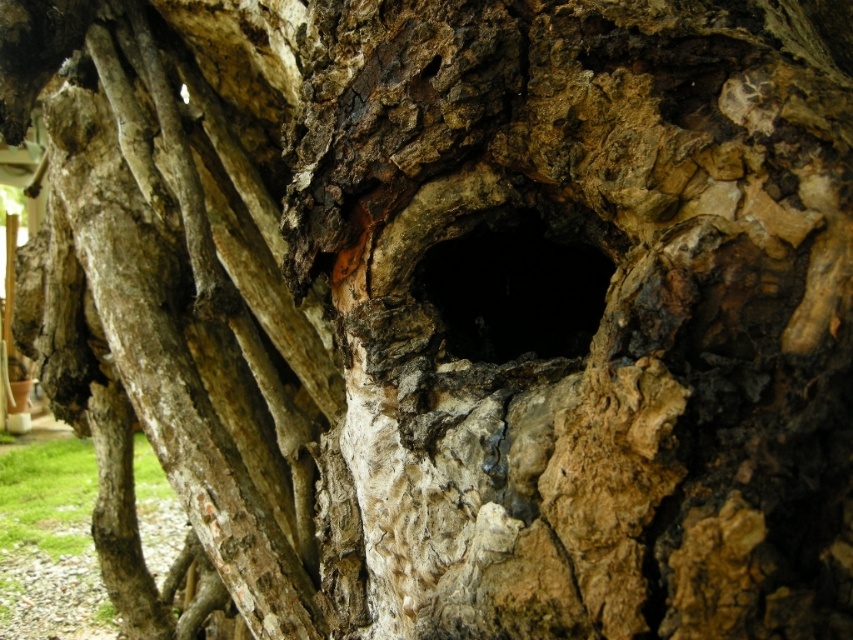
You are a squirrel trying to find a safe spot to hide your acorn. You see a point at coordinates (186, 285) on the tree trunk. Is this point located on the rough bark of the tree trunk?

Yes, the point (186, 285) is on the rough bark tree trunk at center, so it is a suitable location for hiding the acorn.

You are an artist sketching the tree trunk and want to ensure your drawing accurately reflects the spatial relationship between the rough bark tree trunk at center and the black rough hole at center. Based on the scene, which object is positioned to the left of the other?

The rough bark tree trunk at center is to the left of black rough hole at center.

In the scene shown: You have a small wooden rod that is 10 cm in diameter. You want to insert it into the black rough hole at center. Can the rod fit through the hole? Please consider the width of the rough bark tree trunk at center as well.

The rough bark tree trunk at center might be wider than the black rough hole at center, but since the hole is the opening, the rod can only fit if the hole itself is at least 10 cm in diameter. Without knowing the exact size of the hole, it is uncertain if the rod will fit.